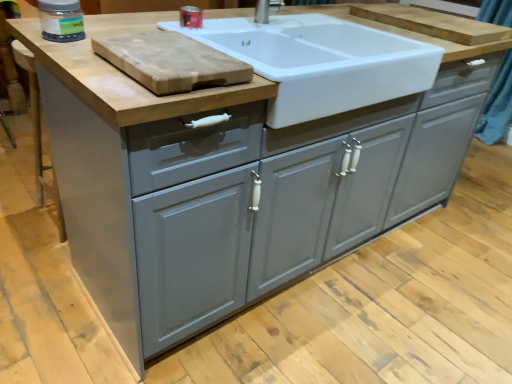
Question: Considering the relative sizes of natural wood cutting board at upper left, the 2th cutting board from the right, and transparent plastic jar at upper left, the 2th appliance viewed from the right, in the image provided, is natural wood cutting board at upper left, the 2th cutting board from the right, taller than transparent plastic jar at upper left, the 2th appliance viewed from the right,?

Choices:
 (A) yes
 (B) no

Answer: (B)

Question: Is natural wood cutting board at upper left, which ranks as the 1th cutting board in front-to-back order, directly adjacent to transparent plastic jar at upper left, which is counted as the first appliance, starting from the left?

Choices:
 (A) no
 (B) yes

Answer: (A)

Question: Is natural wood cutting board at upper left, the 2th cutting board from the right, further to the viewer compared to transparent plastic jar at upper left, which is counted as the first appliance, starting from the left?

Choices:
 (A) yes
 (B) no

Answer: (B)

Question: Is transparent plastic jar at upper left, which is counted as the first appliance, starting from the left, at the back of natural wood cutting board at upper left, the 2th cutting board from the right?

Choices:
 (A) no
 (B) yes

Answer: (A)

Question: Can you confirm if natural wood cutting board at upper left, which is the 1th cutting board from left to right, is thinner than transparent plastic jar at upper left, the 2th appliance viewed from the right?

Choices:
 (A) no
 (B) yes

Answer: (A)

Question: From the image's perspective, is natural wood cutting board at upper left, the second cutting board positioned from the top, located above transparent plastic jar at upper left, which is counted as the 2th appliance, starting from the back?

Choices:
 (A) no
 (B) yes

Answer: (A)

Question: From the image's perspective, is matte plastic container at upper center, arranged as the 1th appliance when viewed from the back, under white glossy sink at upper center?

Choices:
 (A) yes
 (B) no

Answer: (B)

Question: Can you confirm if matte plastic container at upper center, arranged as the 1th appliance when viewed from the back, is smaller than white glossy sink at upper center?

Choices:
 (A) no
 (B) yes

Answer: (B)

Question: Is matte plastic container at upper center, the second appliance positioned from the front, oriented away from white glossy sink at upper center?

Choices:
 (A) no
 (B) yes

Answer: (B)

Question: Could you tell me if matte plastic container at upper center, arranged as the 1th appliance when viewed from the back, is turned towards white glossy sink at upper center?

Choices:
 (A) no
 (B) yes

Answer: (B)

Question: Can you confirm if matte plastic container at upper center, the second appliance positioned from the front, is positioned to the left of white glossy sink at upper center?

Choices:
 (A) no
 (B) yes

Answer: (B)

Question: Is matte plastic container at upper center, the 1th appliance in the right-to-left sequence, completely or partially outside of white glossy sink at upper center?

Choices:
 (A) no
 (B) yes

Answer: (A)

Question: Considering the relative positions of white glossy sink at upper center and transparent plastic jar at upper left, which is counted as the first appliance, starting from the left, in the image provided, is white glossy sink at upper center to the right of transparent plastic jar at upper left, which is counted as the first appliance, starting from the left, from the viewer's perspective?

Choices:
 (A) no
 (B) yes

Answer: (B)